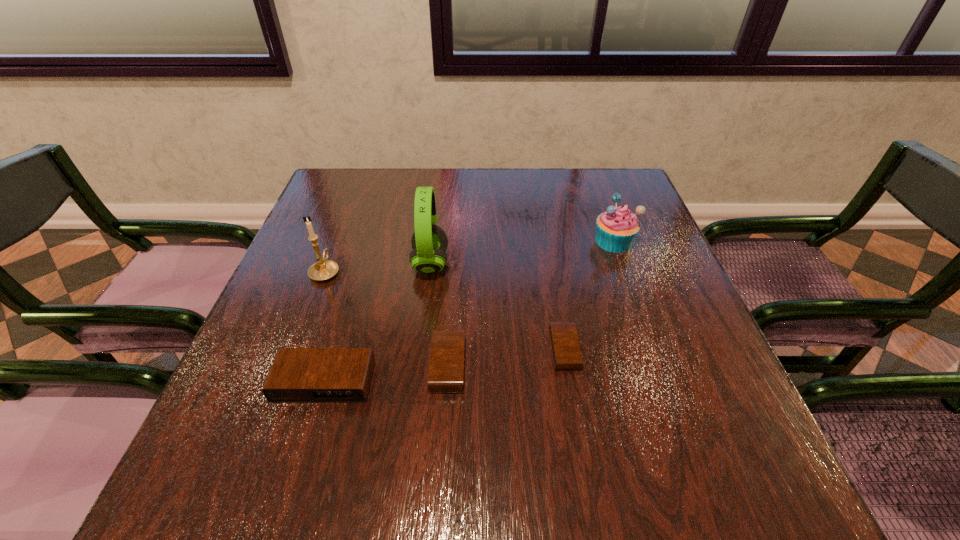
The image size is (960, 540). Find the location of `free space located 0.230m on the front face of the second alarm clock from right to left`. free space located 0.230m on the front face of the second alarm clock from right to left is located at coordinates (311, 365).

Where is `free space located 0.330m on the front face of the second alarm clock from right to left`? free space located 0.330m on the front face of the second alarm clock from right to left is located at coordinates (258, 365).

The height and width of the screenshot is (540, 960). I want to click on free space located 0.120m on the front face of the second alarm clock from right to left, so click(x=369, y=365).

Locate an element on the screen. Image resolution: width=960 pixels, height=540 pixels. vacant space located on the front face of the fifth object from left to right is located at coordinates (669, 349).

Locate an element on the screen. The image size is (960, 540). free spot located on the front of the headset is located at coordinates (420, 350).

Where is `blank area located 0.100m on the front of the rightmost object`? This screenshot has width=960, height=540. blank area located 0.100m on the front of the rightmost object is located at coordinates (629, 283).

Locate an element on the screen. blank space located on the handle side of the fifth shortest object is located at coordinates (347, 216).

At what (x,y) coordinates should I click in order to perform the action: click on vacant space located on the handle side of the fifth shortest object. Please return your answer as a coordinate pair (x, y). Image resolution: width=960 pixels, height=540 pixels. Looking at the image, I should click on (336, 244).

At what (x,y) coordinates should I click in order to perform the action: click on vacant space located on the handle side of the fifth shortest object. Please return your answer as a coordinate pair (x, y). The height and width of the screenshot is (540, 960). Looking at the image, I should click on (337, 241).

The image size is (960, 540). Find the location of `alarm clock located at the left edge`. alarm clock located at the left edge is located at coordinates (298, 375).